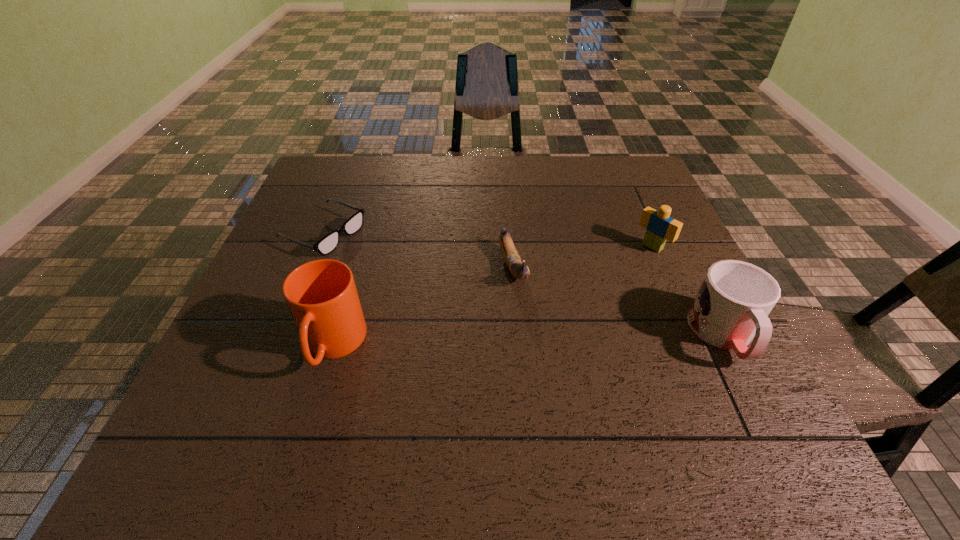
Locate an element on the screen. the left mug is located at coordinates (322, 297).

Where is `the tallest object`? Image resolution: width=960 pixels, height=540 pixels. the tallest object is located at coordinates (322, 297).

The image size is (960, 540). What are the coordinates of `the shorter mug` in the screenshot? It's located at (731, 308).

At what (x,y) coordinates should I click in order to perform the action: click on Lego. Please return your answer as a coordinate pair (x, y). This screenshot has height=540, width=960. Looking at the image, I should click on (660, 227).

You are a GUI agent. You are given a task and a screenshot of the screen. Output one action in this format:
    pyautogui.click(x=<x>, y=<y>)
    Task: Click on the fourth tallest object
    The width and height of the screenshot is (960, 540).
    Given the screenshot: What is the action you would take?
    pyautogui.click(x=518, y=269)

Image resolution: width=960 pixels, height=540 pixels. I want to click on banana, so click(x=518, y=269).

Identify the location of the shortest object. The image size is (960, 540). (328, 243).

I want to click on free space located 0.220m on the face of the Lego, so click(x=589, y=297).

Locate an element on the screen. vacant area located 0.360m on the face of the Lego is located at coordinates (548, 329).

Locate an element on the screen. The width and height of the screenshot is (960, 540). vacant area located 0.400m on the face of the Lego is located at coordinates (536, 340).